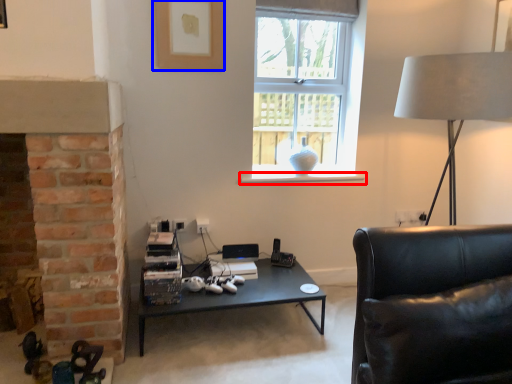
Question: Among these objects, which one is nearest to the camera, window sill (highlighted by a red box) or picture frame (highlighted by a blue box)?

Choices:
 (A) window sill
 (B) picture frame

Answer: (B)